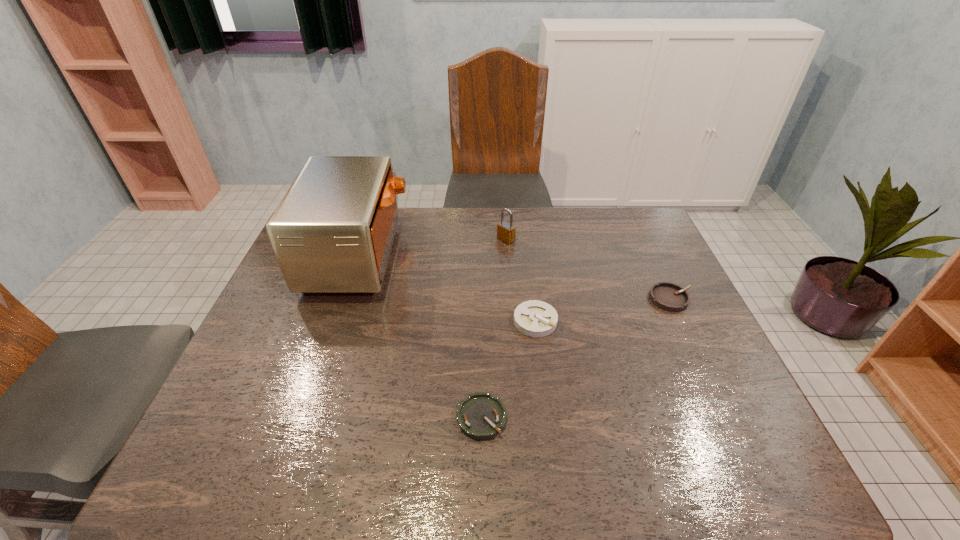
Locate an element on the screen. the leftmost object is located at coordinates (332, 233).

Locate an element on the screen. The height and width of the screenshot is (540, 960). toaster oven is located at coordinates tap(332, 233).

Image resolution: width=960 pixels, height=540 pixels. In order to click on the second tallest object in this screenshot , I will do `click(506, 231)`.

The image size is (960, 540). I want to click on the second ashtray from left to right, so click(534, 318).

Locate an element on the screen. the rightmost object is located at coordinates (667, 296).

The image size is (960, 540). I want to click on the shortest object, so click(481, 416).

I want to click on the shortest ashtray, so click(481, 416).

At what (x,y) coordinates should I click in order to perform the action: click on blank area located on the door side of the tallest object. Please return your answer as a coordinate pair (x, y). Looking at the image, I should click on pyautogui.click(x=511, y=255).

What are the coordinates of `blank space located on the left of the padlock` in the screenshot? It's located at (395, 239).

Identify the location of vacant area situated on the front of the second ashtray from left to right. The height and width of the screenshot is (540, 960). (542, 376).